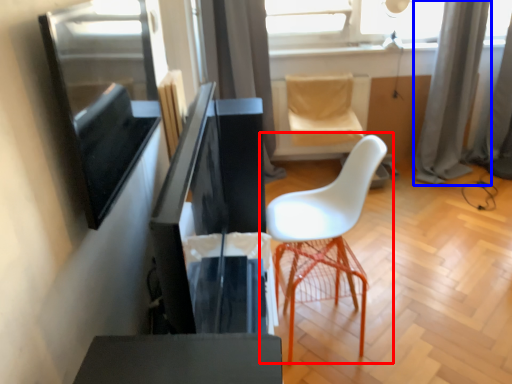
Question: Which object appears closest to the camera in this image, chair (highlighted by a red box) or curtain (highlighted by a blue box)?

Choices:
 (A) chair
 (B) curtain

Answer: (A)